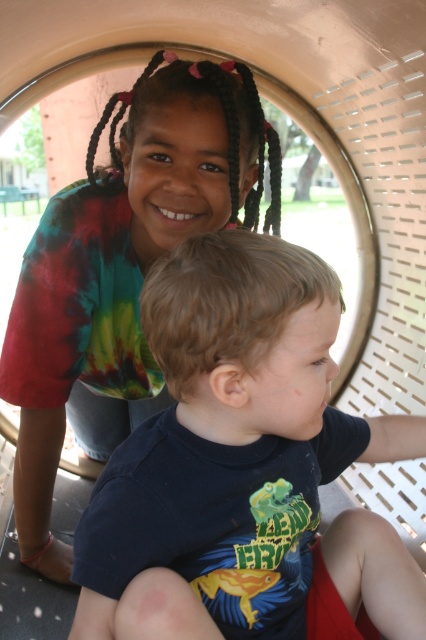
Who is more distant from viewer, (402, 563) or (23, 515)?

The point (23, 515) is behind.

Which is more to the right, dark blue t-shirt at center or tie-dye fabric shirt at upper left?

dark blue t-shirt at center is more to the right.

Where is `dark blue t-shirt at center`? Image resolution: width=426 pixels, height=640 pixels. dark blue t-shirt at center is located at coordinates (227, 449).

This screenshot has width=426, height=640. What are the coordinates of `dark blue t-shirt at center` in the screenshot? It's located at (227, 449).

Who is more forward, (95,390) or (278,156)?

Point (278,156)

Between point (109, 326) and point (259, 198), which one is positioned behind?

The point (109, 326) is behind.

This screenshot has width=426, height=640. In order to click on tie-dye fabric shirt at upper left in this screenshot , I will do `click(121, 269)`.

Can you confirm if dark blue t-shirt at center is bigger than matte black hair at upper center?

Indeed, dark blue t-shirt at center has a larger size compared to matte black hair at upper center.

Locate an element on the screen. The height and width of the screenshot is (640, 426). dark blue t-shirt at center is located at coordinates (227, 449).

Image resolution: width=426 pixels, height=640 pixels. In order to click on dark blue t-shirt at center in this screenshot , I will do `click(227, 449)`.